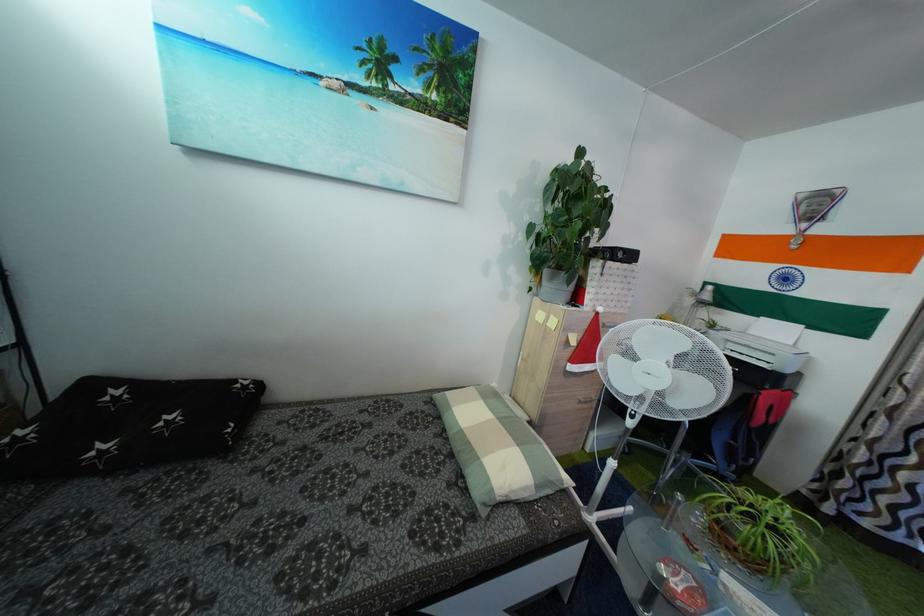
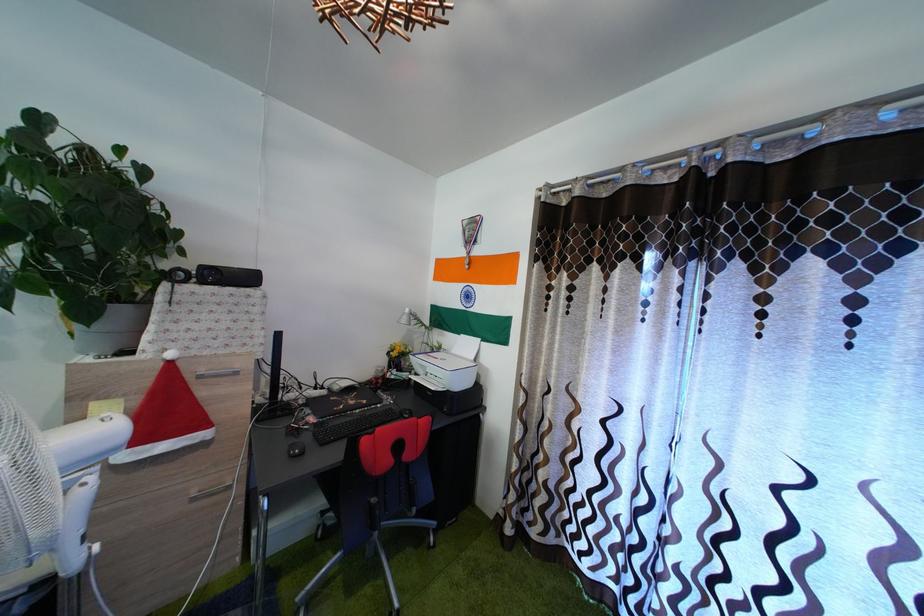
Find the pixel in the second image that matches (x=759, y=339) in the first image.

(462, 359)